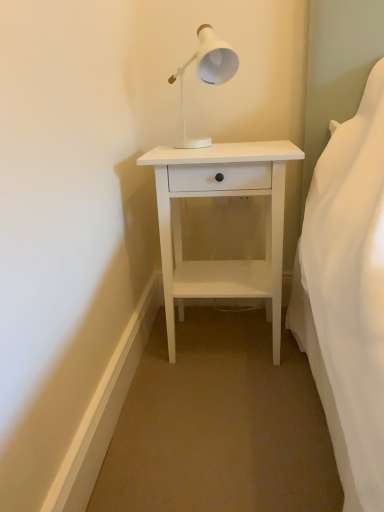
I want to click on unoccupied area in front of white matte lamp at upper center, so click(216, 151).